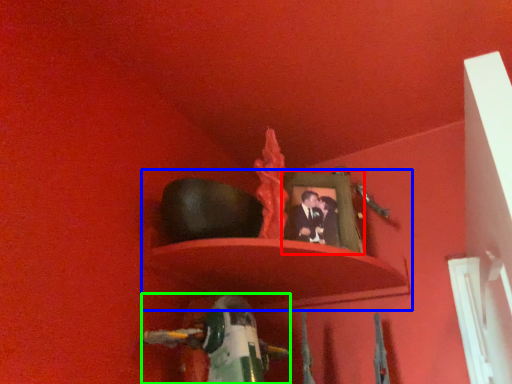
Question: Which object is the closest to the picture frame (highlighted by a red box)? Choose among these: shelf (highlighted by a blue box) or toy (highlighted by a green box).

Choices:
 (A) shelf
 (B) toy

Answer: (A)